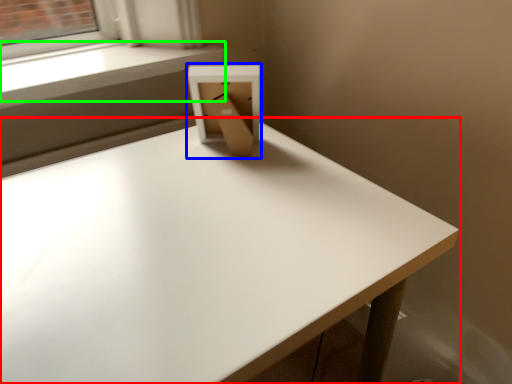
Question: Considering the real-world distances, which object is farthest from table (highlighted by a red box)? cardboard box (highlighted by a blue box) or window sill (highlighted by a green box)?

Choices:
 (A) cardboard box
 (B) window sill

Answer: (B)